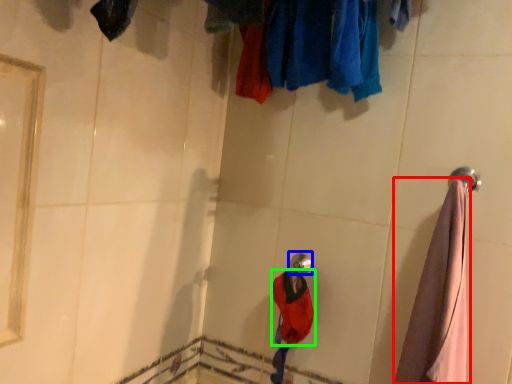
Question: Based on their relative distances, which object is nearer to garment (highlighted by a red box)? Choose from shower (highlighted by a blue box) and clothing (highlighted by a green box).

Choices:
 (A) shower
 (B) clothing

Answer: (B)